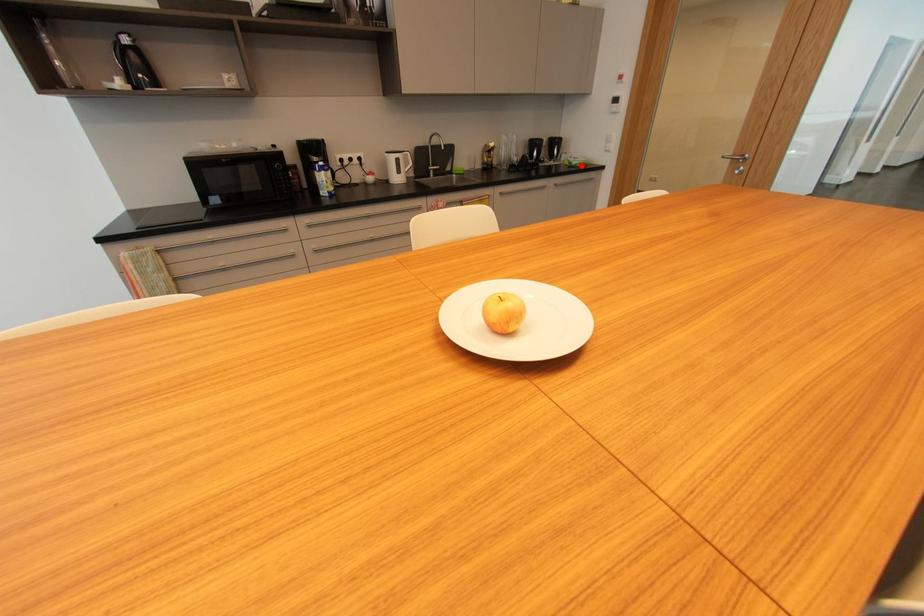
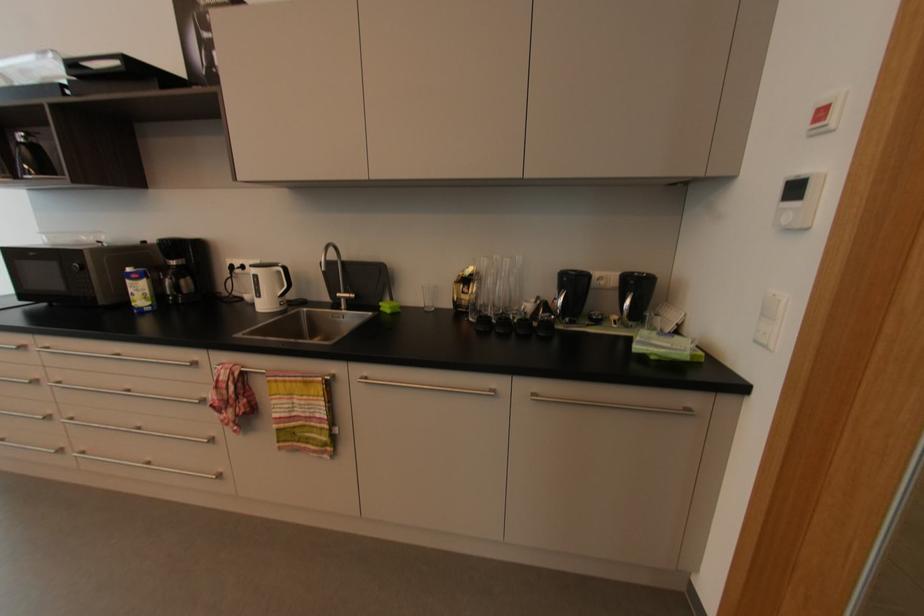
Question: I am providing you with two images of the same scene from different viewpoints. A red point is shown in image1. For the corresponding object point in image2, is it positioned nearer or farther from the camera?

Choices:
 (A) Nearer
 (B) Farther

Answer: (B)